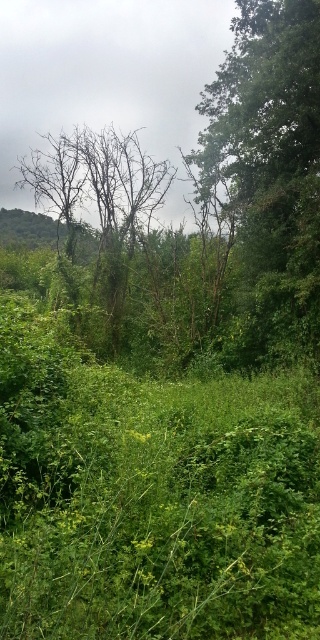
From the picture: You are standing at the center of the scene and want to locate the green leafy tree at upper right. According to the coordinates, where exactly is it positioned?

The green leafy tree at upper right is positioned at coordinates point (270, 170).

You are a hiker navigating through this forest. You need to locate both the green leafy tree at upper right and the bare branches at center. Which one would you look upwards towards from your current position?

The bare branches at center are located above the green leafy tree at upper right, so you should look upwards towards the bare branches at center.